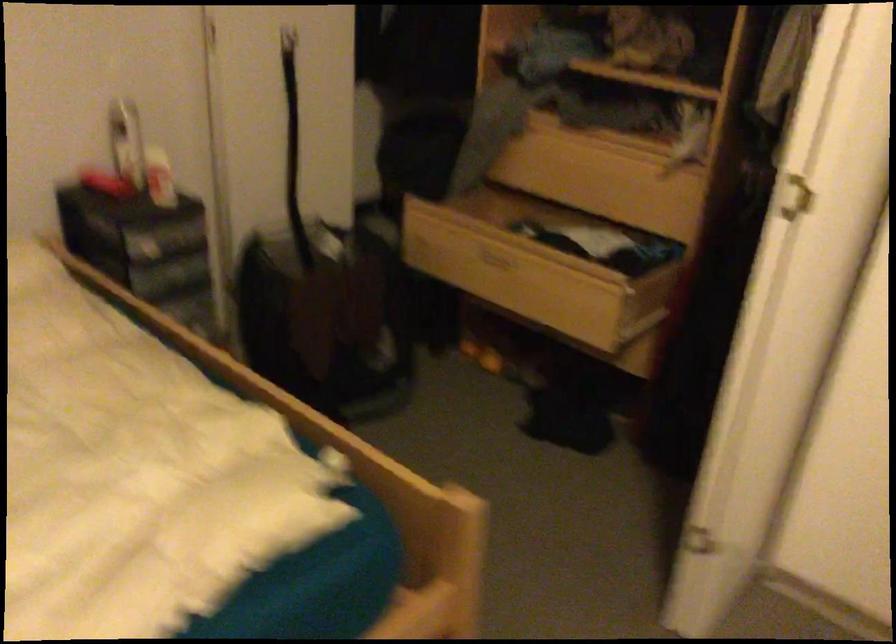
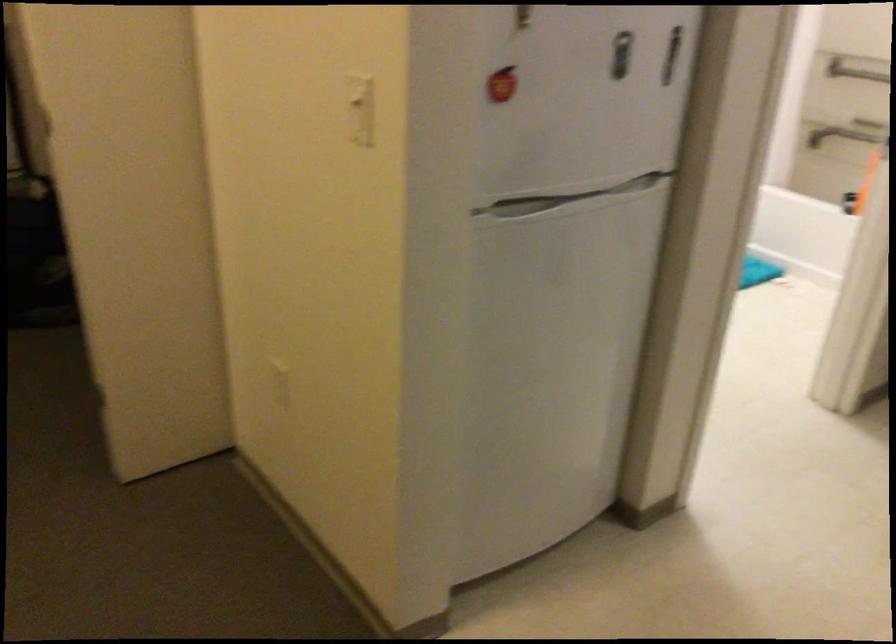
Question: I am providing you with two images of the same scene from different viewpoints. Please identify which objects are invisible in image2.

Choices:
 (A) white light switch
 (B) refrigerator handle
 (C) blue shaker bottle
 (D) open wooden drawer

Answer: (D)